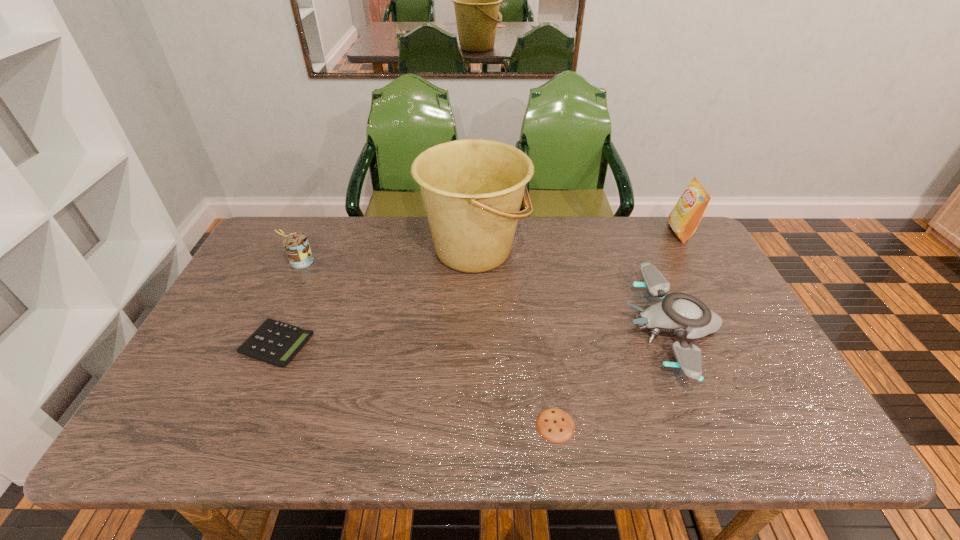
This screenshot has height=540, width=960. In order to click on crisp (potato chip) present at the far edge in this screenshot , I will do `click(685, 217)`.

The width and height of the screenshot is (960, 540). Identify the location of can that is positioned at the far edge. (296, 245).

At what (x,y) coordinates should I click in order to perform the action: click on object at the near edge. Please return your answer as a coordinate pair (x, y). The height and width of the screenshot is (540, 960). Looking at the image, I should click on (555, 425).

This screenshot has width=960, height=540. What are the coordinates of `can at the left edge` in the screenshot? It's located at (296, 245).

The width and height of the screenshot is (960, 540). Find the location of `calculator that is at the left edge`. calculator that is at the left edge is located at coordinates (274, 342).

Locate an element on the screen. The height and width of the screenshot is (540, 960). crisp (potato chip) that is at the right edge is located at coordinates (685, 217).

This screenshot has width=960, height=540. I want to click on drone situated at the right edge, so click(x=683, y=314).

Identify the location of object positioned at the far left corner. This screenshot has height=540, width=960. (296, 245).

What are the coordinates of `object at the far right corner` in the screenshot? It's located at (685, 217).

In the image, there is a desktop. Where is `vacant space at the far edge`? The width and height of the screenshot is (960, 540). vacant space at the far edge is located at coordinates (390, 218).